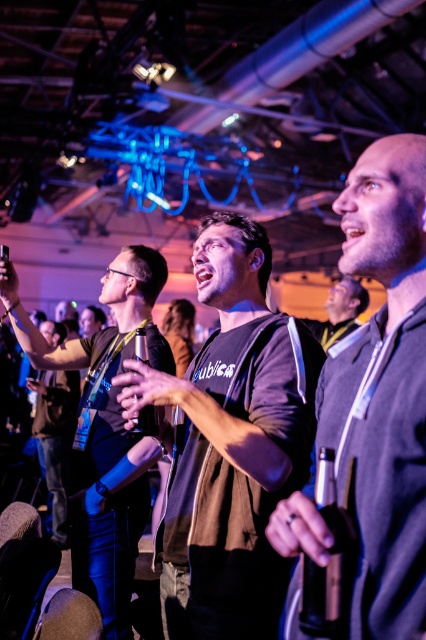
You are standing in the middle of the room and see two points marked in the image. Which point is closer to you, point at coordinate [245,252] or point at coordinate [417,368]?

Point at coordinate [245,252] is closer to you because it is further to the viewer than point at coordinate [417,368].

Please describe the location of the point with coordinates point (x=382, y=388) in the image. Which object is it pointing to?

The point (x=382, y=388) corresponds to dark gray fleece at center.